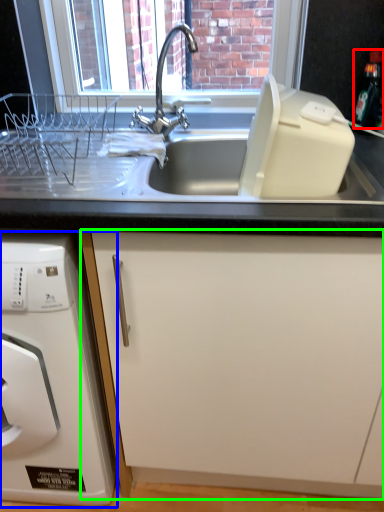
Question: Considering the real-world distances, which object is farthest from bottle (highlighted by a red box)? home appliance (highlighted by a blue box) or cabinetry (highlighted by a green box)?

Choices:
 (A) home appliance
 (B) cabinetry

Answer: (A)